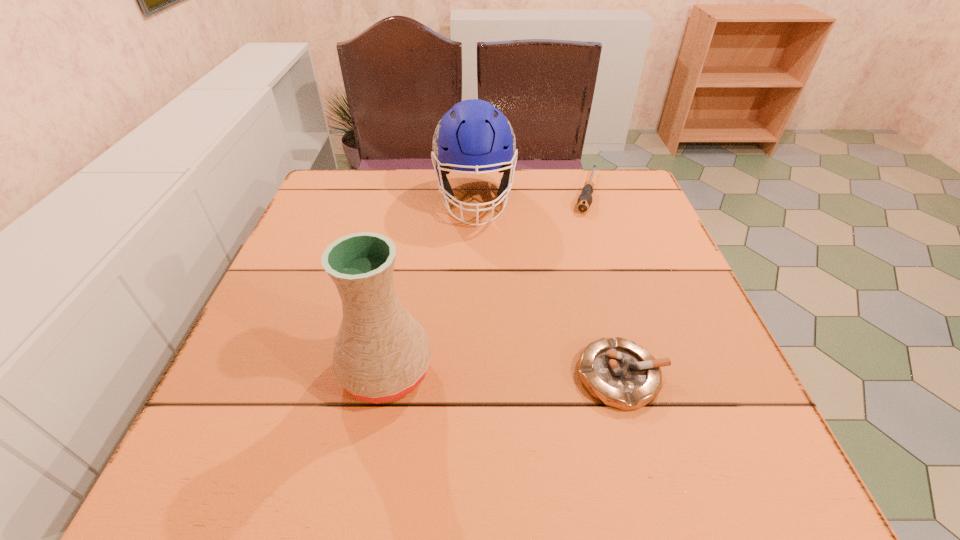
I want to click on vacant space at the far edge of the desktop, so click(x=455, y=180).

In the image, there is a desktop. Where is `vacant space at the near edge`? Image resolution: width=960 pixels, height=540 pixels. vacant space at the near edge is located at coordinates (336, 402).

In the image, there is a desktop. In order to click on vacant space at the left edge in this screenshot , I will do `click(295, 288)`.

This screenshot has height=540, width=960. Identify the location of free region at the right edge of the desktop. (684, 302).

In the image, there is a desktop. In order to click on free space at the far left corner in this screenshot , I will do `click(362, 186)`.

The width and height of the screenshot is (960, 540). What are the coordinates of `vacant point located between the ashtray and the screwdriver` in the screenshot? It's located at tap(604, 284).

This screenshot has width=960, height=540. What are the coordinates of `empty space between the screwdriver and the pottery` in the screenshot? It's located at (487, 281).

I want to click on vacant point located between the ashtray and the screwdriver, so click(604, 284).

Where is `empty space between the ashtray and the football helmet`? empty space between the ashtray and the football helmet is located at coordinates (548, 287).

You are a GUI agent. You are given a task and a screenshot of the screen. Output one action in this format:
    pyautogui.click(x=<x>, y=<y>)
    Task: Click on the vacant region between the screwdriver and the ashtray
    This screenshot has width=960, height=540.
    Given the screenshot: What is the action you would take?
    pyautogui.click(x=604, y=284)